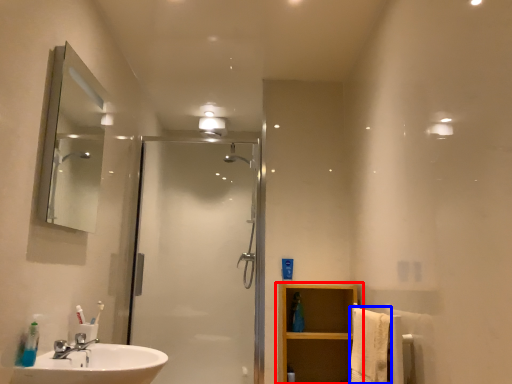
Question: Which point is further to the camera, bathroom cabinet (highlighted by a red box) or bath towel (highlighted by a blue box)?

Choices:
 (A) bathroom cabinet
 (B) bath towel

Answer: (A)